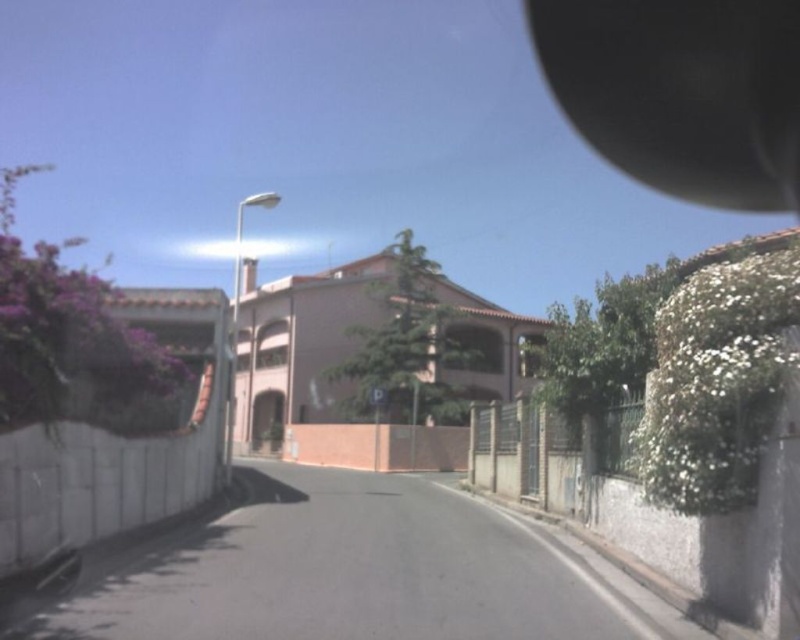
You are a delivery driver navigating a narrow street. You need to ensure your vehicle can pass between the metallic silver fence at right and the low wall with purple flowers on the left. Based on the given coordinates, can you determine if there is enough space for your vehicle, which is 2 meters wide?

The metallic silver fence at right is located at point (x=545, y=454). However, without knowing the exact position of the low wall with purple flowers on the left, it is impossible to determine the distance between them. Therefore, the space availability cannot be confirmed.

You are sitting in the vehicle and looking out the window. You see two points marked on the road ahead. The first point is at coordinate point (722, 124) and the second is at point (564, 477). Which point is closer to your current position inside the vehicle?

Point (722, 124) is closer to your current position inside the vehicle because it is further to the camera than point (564, 477). Since the camera is inside the vehicle, points further to the camera are closer to the vehicle.

You are a delivery driver who needs to check the blind spot before turning left. You see the black matte view mirror at upper right and the brick wall at center. Which object is positioned higher in the scene?

The black matte view mirror at upper right is positioned higher than the brick wall at center.